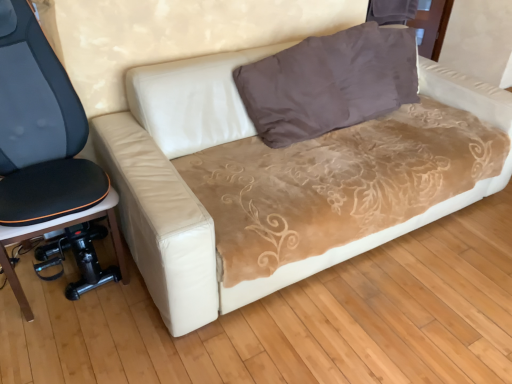
Identify the location of free space between beige suede couch at center and black fabric office chair at left. The width and height of the screenshot is (512, 384). (111, 330).